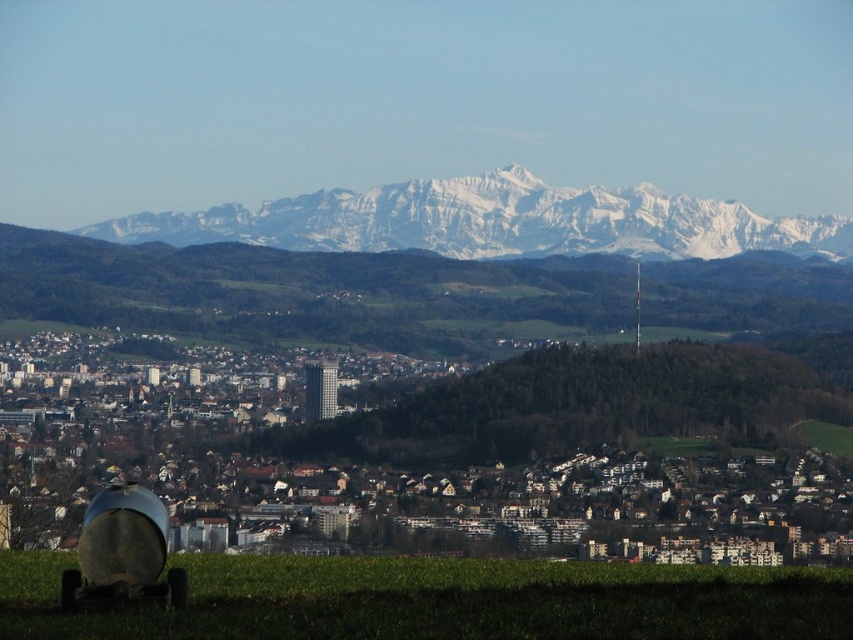
This screenshot has height=640, width=853. What are the coordinates of `green grass at lower center` in the screenshot? It's located at (444, 600).

Which is behind, point (271, 632) or point (364, 211)?

The point (271, 632) is more distant.

Is point (270, 630) positioned behind point (322, 218)?

That is True.

Where is `green grass at lower center`? This screenshot has height=640, width=853. green grass at lower center is located at coordinates (444, 600).